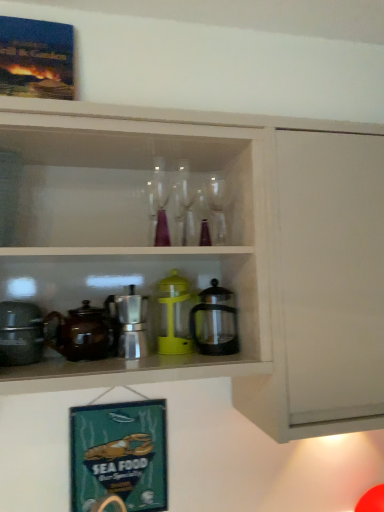
Question: Can you confirm if clear glass wine glass at center, which is counted as the 2th wine glass, starting from the right, is wider than matte black pot at left, the second appliance when ordered from right to left?

Choices:
 (A) yes
 (B) no

Answer: (B)

Question: Does clear glass wine glass at center, which is counted as the 2th wine glass, starting from the right, have a greater height compared to matte black pot at left, positioned as the first appliance in left-to-right order?

Choices:
 (A) yes
 (B) no

Answer: (A)

Question: From a real-world perspective, is clear glass wine glass at center, positioned as the first wine glass in left-to-right order, below matte black pot at left, the second appliance when ordered from right to left?

Choices:
 (A) no
 (B) yes

Answer: (A)

Question: Is clear glass wine glass at center, positioned as the first wine glass in left-to-right order, far away from matte black pot at left, the second appliance when ordered from right to left?

Choices:
 (A) no
 (B) yes

Answer: (A)

Question: Is clear glass wine glass at center, positioned as the first wine glass in left-to-right order, turned away from matte black pot at left, the second appliance when ordered from right to left?

Choices:
 (A) no
 (B) yes

Answer: (A)

Question: Is the depth of clear glass wine glass at center, which is counted as the 2th wine glass, starting from the right, less than that of matte black pot at left, positioned as the first appliance in left-to-right order?

Choices:
 (A) no
 (B) yes

Answer: (A)

Question: Considering the relative sizes of matte black pot at left, the second appliance when ordered from right to left, and clear glass wine glass at center, which ranks as the 2th wine glass in left-to-right order, in the image provided, is matte black pot at left, the second appliance when ordered from right to left, taller than clear glass wine glass at center, which ranks as the 2th wine glass in left-to-right order,?

Choices:
 (A) no
 (B) yes

Answer: (A)

Question: Is the depth of matte black pot at left, positioned as the first appliance in left-to-right order, greater than that of clear glass wine glass at center, which ranks as the 2th wine glass in left-to-right order?

Choices:
 (A) yes
 (B) no

Answer: (B)

Question: Is clear glass wine glass at center, the first wine glass in the right-to-left sequence, at the back of matte black pot at left, the second appliance when ordered from right to left?

Choices:
 (A) yes
 (B) no

Answer: (B)

Question: Is matte black pot at left, positioned as the first appliance in left-to-right order, at the right side of clear glass wine glass at center, the first wine glass in the right-to-left sequence?

Choices:
 (A) yes
 (B) no

Answer: (B)

Question: Is matte black pot at left, positioned as the first appliance in left-to-right order, at the left side of clear glass wine glass at center, which ranks as the 2th wine glass in left-to-right order?

Choices:
 (A) no
 (B) yes

Answer: (B)

Question: Considering the relative sizes of matte black pot at left, positioned as the first appliance in left-to-right order, and clear glass wine glass at center, which ranks as the 2th wine glass in left-to-right order, in the image provided, is matte black pot at left, positioned as the first appliance in left-to-right order, shorter than clear glass wine glass at center, which ranks as the 2th wine glass in left-to-right order,?

Choices:
 (A) no
 (B) yes

Answer: (B)

Question: Is clear glass wine glass at center, positioned as the first wine glass in left-to-right order, a part of wooden picture frame at upper left, which is the first picture frame in top-to-bottom order?

Choices:
 (A) yes
 (B) no

Answer: (B)